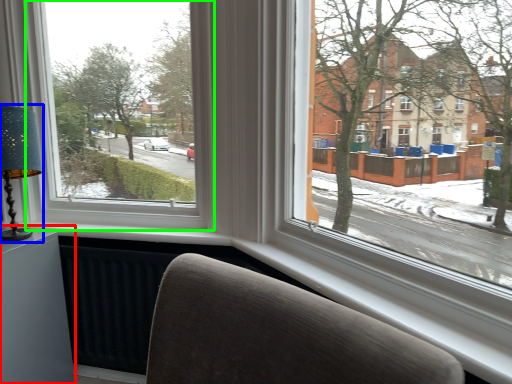
Question: Considering the real-world distances, which object is closest to table (highlighted by a red box)? table lamp (highlighted by a blue box) or window (highlighted by a green box).

Choices:
 (A) table lamp
 (B) window

Answer: (A)